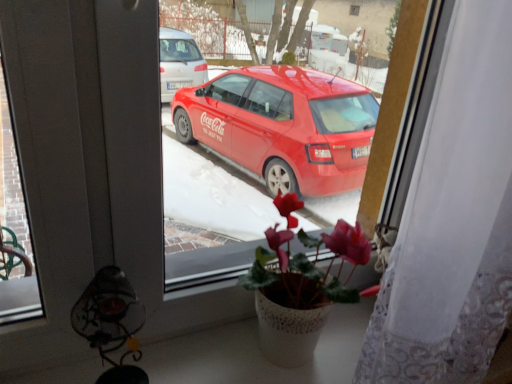
Question: Does white lace curtain at right appear on the right side of pink matte cyclamen at center?

Choices:
 (A) yes
 (B) no

Answer: (A)

Question: Can you confirm if white lace curtain at right is smaller than pink matte cyclamen at center?

Choices:
 (A) no
 (B) yes

Answer: (A)

Question: Is white lace curtain at right taller than pink matte cyclamen at center?

Choices:
 (A) yes
 (B) no

Answer: (A)

Question: Does white lace curtain at right have a lesser height compared to pink matte cyclamen at center?

Choices:
 (A) no
 (B) yes

Answer: (A)

Question: Does white lace curtain at right have a lesser width compared to pink matte cyclamen at center?

Choices:
 (A) no
 (B) yes

Answer: (A)

Question: From a real-world perspective, is white lace curtain at right located beneath pink matte cyclamen at center?

Choices:
 (A) yes
 (B) no

Answer: (B)

Question: Is white lace curtain at right outside of metallic wire lamp at lower left?

Choices:
 (A) no
 (B) yes

Answer: (B)

Question: Is the depth of white lace curtain at right less than that of metallic wire lamp at lower left?

Choices:
 (A) yes
 (B) no

Answer: (A)

Question: From the image's perspective, is white lace curtain at right located above metallic wire lamp at lower left?

Choices:
 (A) yes
 (B) no

Answer: (A)

Question: From the image's perspective, would you say white lace curtain at right is shown under metallic wire lamp at lower left?

Choices:
 (A) yes
 (B) no

Answer: (B)

Question: Does white lace curtain at right have a smaller size compared to metallic wire lamp at lower left?

Choices:
 (A) yes
 (B) no

Answer: (B)

Question: Is white lace curtain at right next to metallic wire lamp at lower left?

Choices:
 (A) yes
 (B) no

Answer: (B)

Question: Is pink matte cyclamen at center smaller than white lace curtain at right?

Choices:
 (A) no
 (B) yes

Answer: (B)